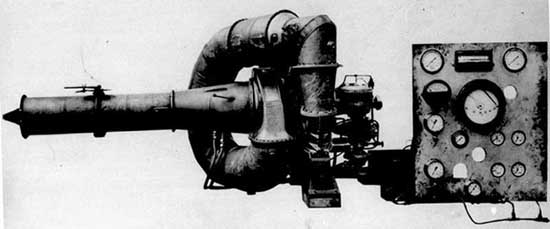
I want to click on empty space below status board, so click(446, 215).